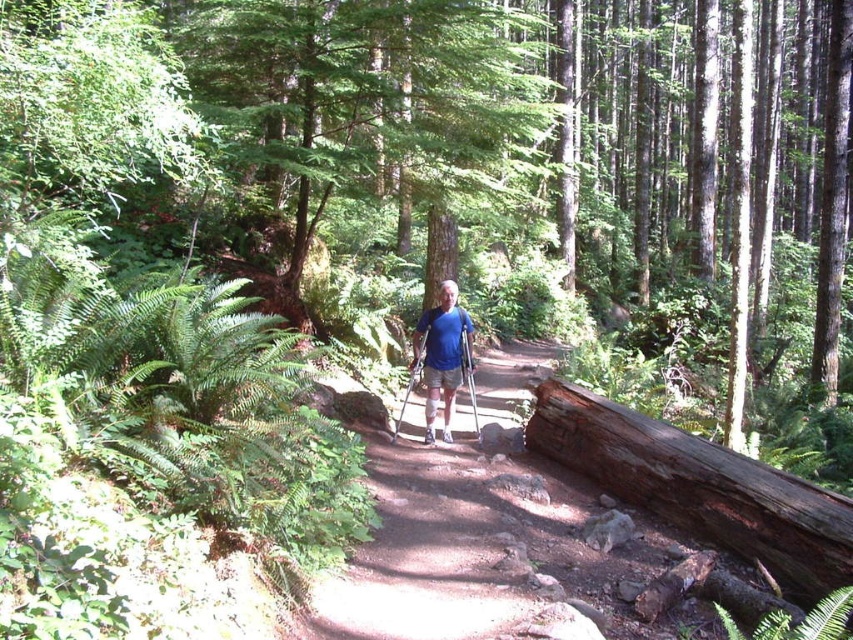
Question: Which point is closer to the camera?

Choices:
 (A) weathered brown log at right
 (B) blue fabric shirt at center

Answer: (A)

Question: Is weathered brown log at right wider than blue fabric shirt at center?

Choices:
 (A) yes
 (B) no

Answer: (A)

Question: Which object is farther from the camera taking this photo?

Choices:
 (A) weathered brown log at right
 (B) blue fabric shirt at center

Answer: (B)

Question: Does weathered brown log at right appear on the left side of blue fabric shirt at center?

Choices:
 (A) no
 (B) yes

Answer: (A)

Question: Which point appears closest to the camera in this image?

Choices:
 (A) (772, 470)
 (B) (428, 419)

Answer: (A)

Question: Observing the image, what is the correct spatial positioning of weathered brown log at right in reference to blue fabric shirt at center?

Choices:
 (A) above
 (B) below

Answer: (B)